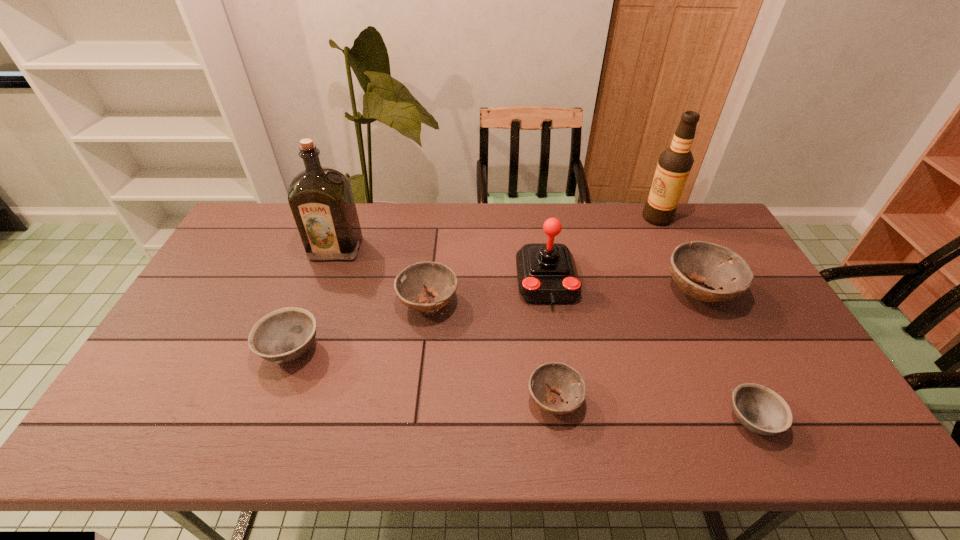
In order to click on free space at the near edge of the desktop in this screenshot , I will do `click(534, 427)`.

Find the location of a particular element. vacant space at the left edge of the desktop is located at coordinates (207, 273).

The image size is (960, 540). In the image, there is a desktop. Identify the location of vacant space at the right edge. (812, 368).

Where is `vacant space at the far left corner`? vacant space at the far left corner is located at coordinates (263, 214).

Where is `free space at the near left corner of the desktop`? free space at the near left corner of the desktop is located at coordinates (127, 443).

Identify the location of free space between the liquor and the leftmost brown bowl. click(382, 276).

Locate an element on the screen. Image resolution: width=960 pixels, height=540 pixels. vacant space that's between the alcohol and the right gray bowl is located at coordinates pos(705,319).

This screenshot has height=540, width=960. Find the location of `free space between the third bowl from right to left and the second smallest brown bowl`. free space between the third bowl from right to left and the second smallest brown bowl is located at coordinates (492, 352).

Image resolution: width=960 pixels, height=540 pixels. I want to click on free point between the biggest brown bowl and the third bowl from right to left, so click(627, 346).

Image resolution: width=960 pixels, height=540 pixels. Find the location of `free space between the fourth tallest object and the leftmost bowl`. free space between the fourth tallest object and the leftmost bowl is located at coordinates (495, 321).